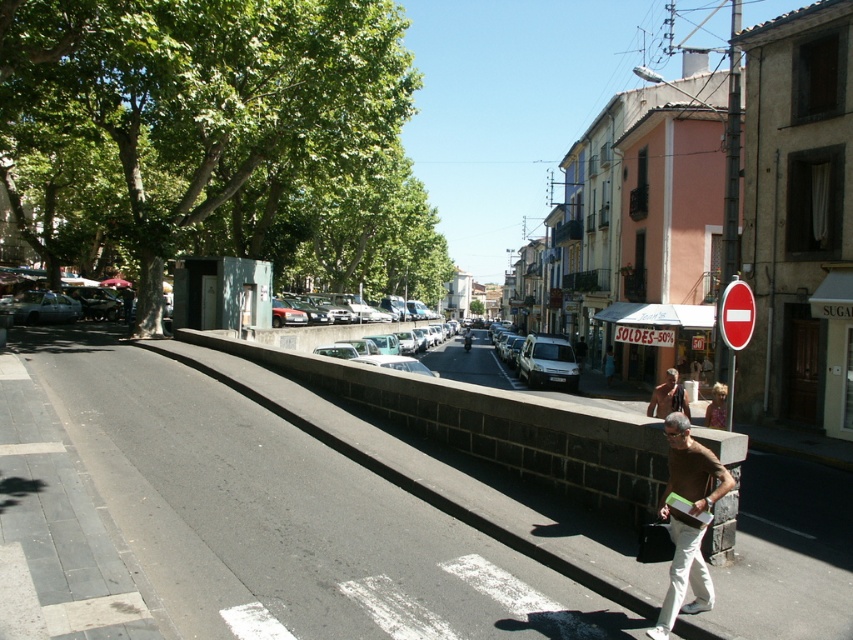
Does red plastic sign at center right come in front of brown leather jacket at center?

Yes, it is.

Does red plastic sign at center right have a greater height compared to brown leather jacket at center?

No.

Is point (737, 346) behind point (664, 401)?

No, (737, 346) is in front of (664, 401).

The height and width of the screenshot is (640, 853). In order to click on red plastic sign at center right in this screenshot , I will do `click(735, 314)`.

From the picture: Is brown cotton shirt at lower right in front of red plastic sign at center right?

Yes.

Is brown cotton shirt at lower right below red plastic sign at center right?

Indeed, brown cotton shirt at lower right is positioned under red plastic sign at center right.

Which is in front, point (692, 540) or point (726, 317)?

Point (692, 540)

Where is `brown cotton shirt at lower right`? The height and width of the screenshot is (640, 853). brown cotton shirt at lower right is located at coordinates (691, 468).

Between brown cotton shirt at lower right and brown leather jacket at center, which one is positioned higher?

brown cotton shirt at lower right is higher up.

Which is more to the right, brown cotton shirt at lower right or brown leather jacket at center?

From the viewer's perspective, brown leather jacket at center appears more on the right side.

Is point (671, 449) less distant than point (677, 374)?

Yes, it is.

This screenshot has width=853, height=640. I want to click on brown cotton shirt at lower right, so [x=691, y=468].